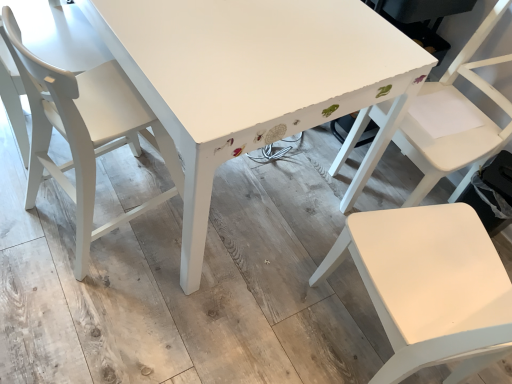
Question: Is white painted wood table at center taller or shorter than white matte chair at center, the 1th chair when ordered from right to left?

Choices:
 (A) tall
 (B) short

Answer: (B)

Question: Which is correct: white painted wood table at center is inside white matte chair at center, the 1th chair when ordered from right to left, or outside of it?

Choices:
 (A) outside
 (B) inside

Answer: (A)

Question: Which of these objects is positioned closest to the matte white chair at left, which is the 1th chair from left to right?

Choices:
 (A) white matte chair at center, the 1th chair when ordered from right to left
 (B) white painted wood table at center
 (C) white matte chair at right, the 2th chair when ordered from right to left

Answer: (B)

Question: Estimate the real-world distances between objects in this image. Which object is farther from the matte white chair at left, positioned as the third chair in right-to-left order?

Choices:
 (A) white matte chair at center, which is counted as the 3th chair, starting from the left
 (B) white matte chair at right, the 2th chair when ordered from right to left
 (C) white painted wood table at center

Answer: (A)